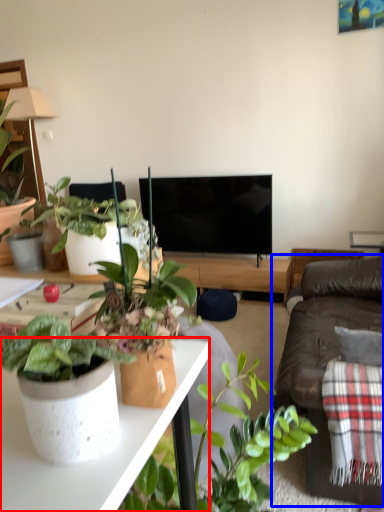
Question: Which of the following is the farthest to the observer, desk (highlighted by a red box) or studio couch (highlighted by a blue box)?

Choices:
 (A) desk
 (B) studio couch

Answer: (B)